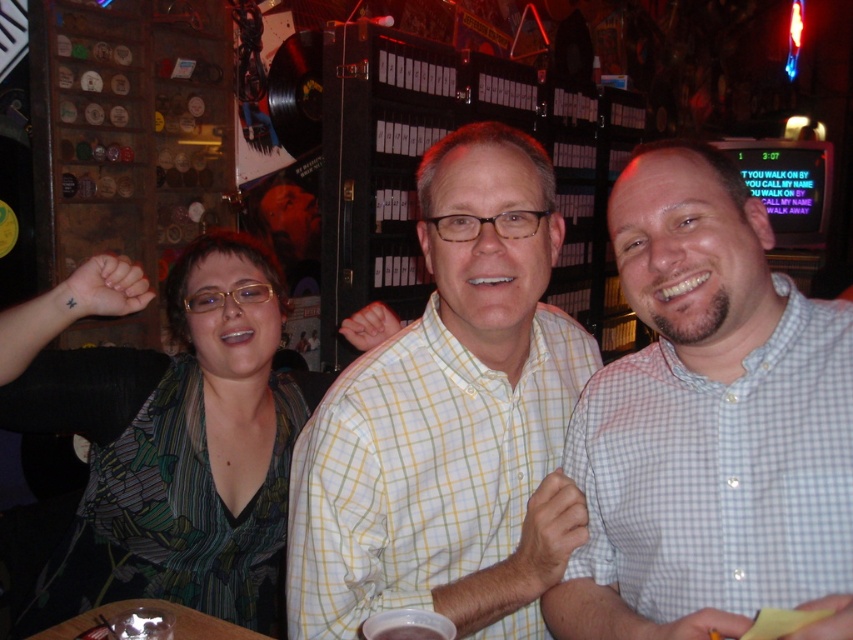
From the picture: You are at a bar and want to take a photo of the two people in the center. The white checkered shirt at center and the green printed dress at center. Which one is wider?

The green printed dress at center is wider than the white checkered shirt at center.

You are standing in the bar and want to locate the white checkered shirt at center. According to the coordinates given, where would you find it?

The white checkered shirt at center is located at the 2D coordinates point (709, 424).

You are a photographer standing at the entrance of the bar. You want to take a photo of the white checkered shirt at center and the woman with short hair and glasses on the left. How far apart are they in inches?

The white checkered shirt at center and the woman with short hair and glasses on the left are 28.31 inches apart.